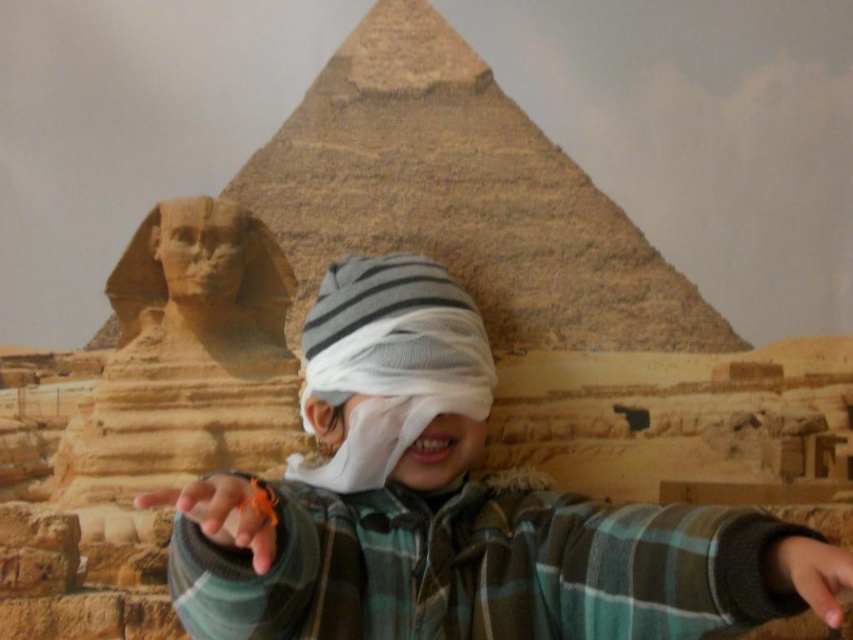
Question: Which object is farther from the camera taking this photo?

Choices:
 (A) smooth stone sphinx at center
 (B) smooth skin hand at lower right

Answer: (A)

Question: Does white fabric headscarf at center appear over smooth stone sphinx at center?

Choices:
 (A) yes
 (B) no

Answer: (B)

Question: Observing the image, what is the correct spatial positioning of striped knit hat at center in reference to orange string at center?

Choices:
 (A) left
 (B) right

Answer: (B)

Question: Can you confirm if white fabric headscarf at center is wider than orange string at center?

Choices:
 (A) yes
 (B) no

Answer: (B)

Question: Which object appears closest to the camera in this image?

Choices:
 (A) white fabric headscarf at center
 (B) orange string at center

Answer: (B)

Question: Which object is positioned closest to the smooth stone sphinx at center?

Choices:
 (A) striped knit hat at center
 (B) smooth skin hand at lower right

Answer: (A)